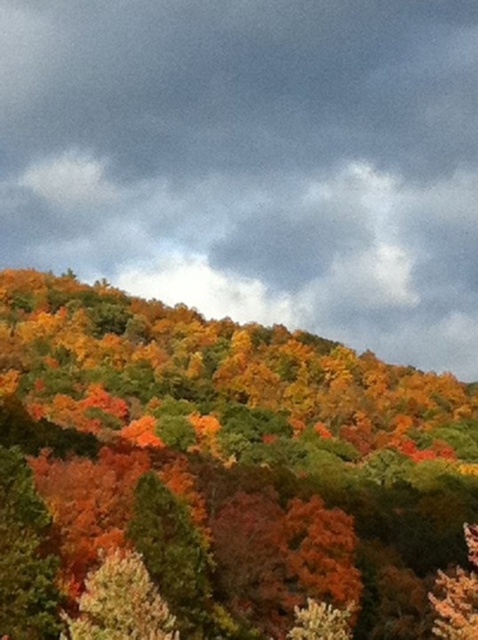
From the picture: You are standing in the autumn forest looking towards the hill. Which object is positioned to the right when comparing the cloudy gray sky at upper center and the multicolored foliage at center?

The cloudy gray sky at upper center is positioned to the right of the multicolored foliage at center.

You are an artist planning to paint the cloudy gray sky at upper center and the multicolored foliage at center. Which area will require more paint considering their sizes?

The cloudy gray sky at upper center will require more paint because its width is larger than the multicolored foliage at center.

Based on the scene description, where is the cloudy gray sky at upper center located in the image?

The cloudy gray sky at upper center is located at point coordinates of (253, 161).